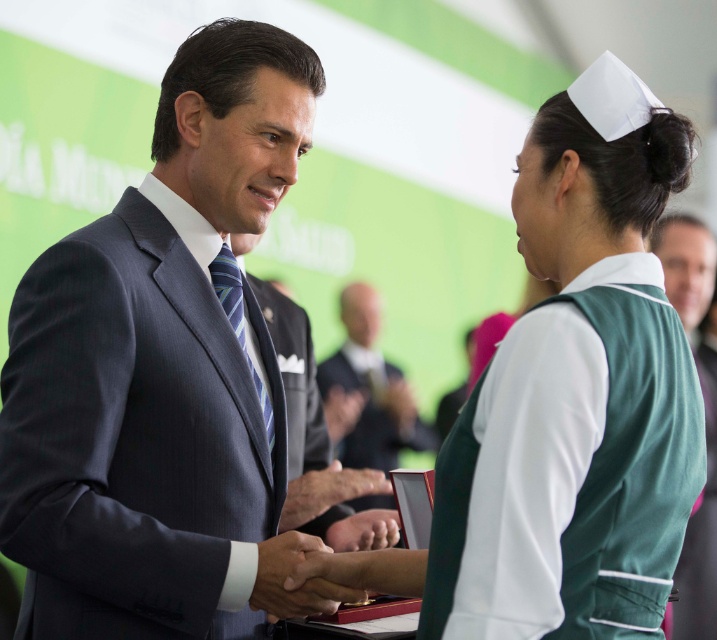
Question: Does dark gray suit at center have a larger size compared to matte black suit at center?

Choices:
 (A) yes
 (B) no

Answer: (B)

Question: Among these objects, which one is nearest to the camera?

Choices:
 (A) green fabric vest at center
 (B) dark gray suit at center
 (C) matte black suit at center
 (D) smooth leather hand at center

Answer: (B)

Question: Which of the following is the farthest from the observer?

Choices:
 (A) (683, 326)
 (B) (280, 564)
 (C) (424, 436)
 (D) (110, 531)

Answer: (C)

Question: Which point is farther from the camera taking this photo?

Choices:
 (A) (706, 596)
 (B) (381, 497)
 (C) (32, 369)
 (D) (326, 548)

Answer: (B)

Question: Does dark gray suit at center have a lesser width compared to green fabric vest at center?

Choices:
 (A) no
 (B) yes

Answer: (A)

Question: Can you confirm if dark gray suit at center is smaller than matte black suit at center?

Choices:
 (A) yes
 (B) no

Answer: (A)